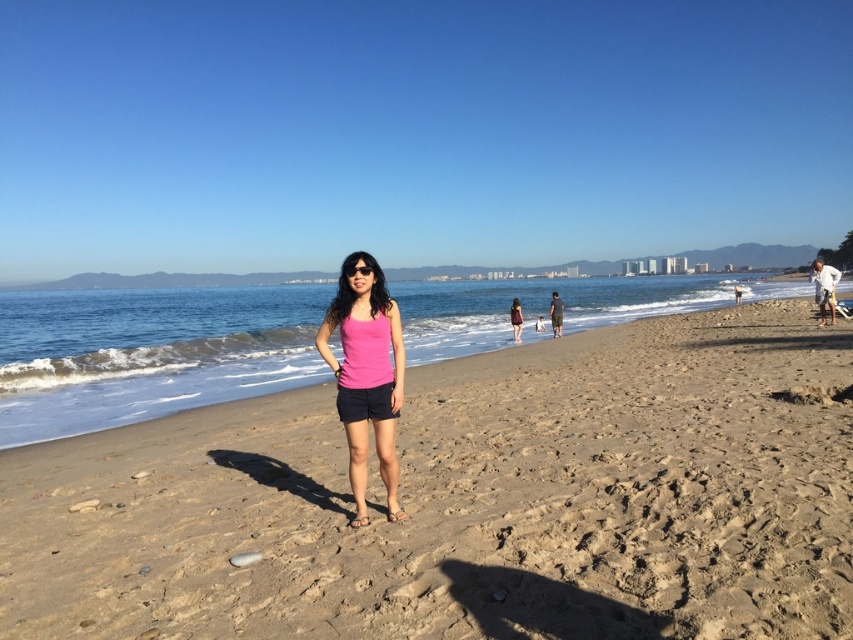
Question: From the image, what is the correct spatial relationship of light brown sandy beach at center in relation to matte pink tank top at center?

Choices:
 (A) right
 (B) left

Answer: (B)

Question: Is light brown sandy beach at center to the left of matte pink tank top at center from the viewer's perspective?

Choices:
 (A) yes
 (B) no

Answer: (A)

Question: Which object is positioned farthest from the pink fabric tank top at center?

Choices:
 (A) light brown sandy beach at center
 (B) matte pink tank top at center

Answer: (B)

Question: Is the position of light brown sandy beach at center more distant than that of matte pink tank top at center?

Choices:
 (A) yes
 (B) no

Answer: (B)

Question: Based on their relative distances, which object is farther from the light brown sandy beach at center?

Choices:
 (A) matte pink tank top at center
 (B) pink fabric tank top at center

Answer: (A)

Question: Which of the following is the closest to the observer?

Choices:
 (A) (573, 346)
 (B) (514, 316)

Answer: (A)